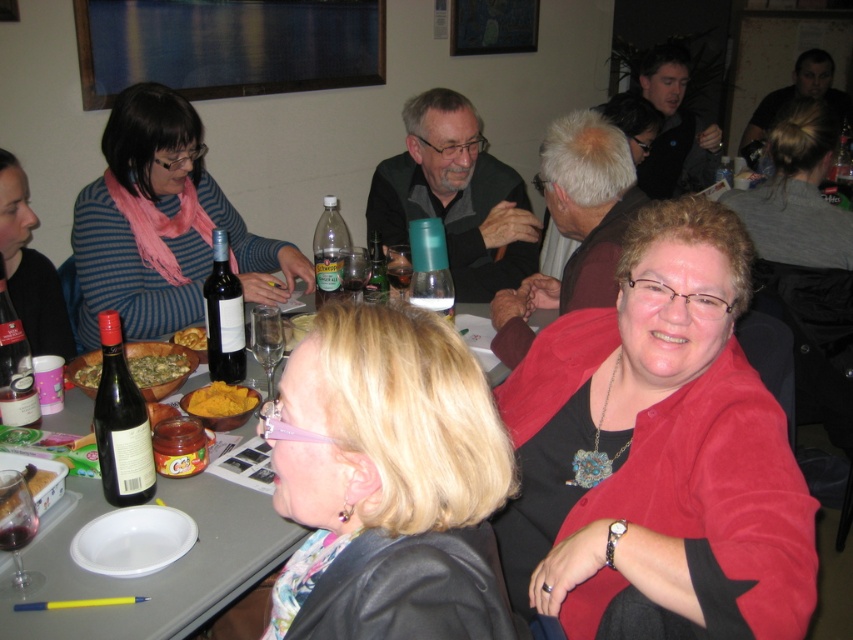
Question: Does red velvet sweater at lower right have a greater width compared to green leafymaterial/texturevegetable at table?

Choices:
 (A) no
 (B) yes

Answer: (B)

Question: Among these points, which one is nearest to the camera?

Choices:
 (A) (167, 371)
 (B) (364, 280)
 (C) (186, 339)

Answer: (A)

Question: Does red velvet sweater at lower right come in front of dark red glass at table front?

Choices:
 (A) no
 (B) yes

Answer: (B)

Question: Which object is closer to the camera taking this photo?

Choices:
 (A) translucent glass wine at table center
 (B) green leafymaterial/texturevegetable at table
 (C) blonde hair at center

Answer: (C)

Question: Does red velvet sweater at lower right have a greater width compared to dark red glass bottle at table center?

Choices:
 (A) yes
 (B) no

Answer: (A)

Question: Which is nearer to the green matte bowl at center?

Choices:
 (A) striped knit sweater at upper left
 (B) matte glass bottle at table left

Answer: (B)